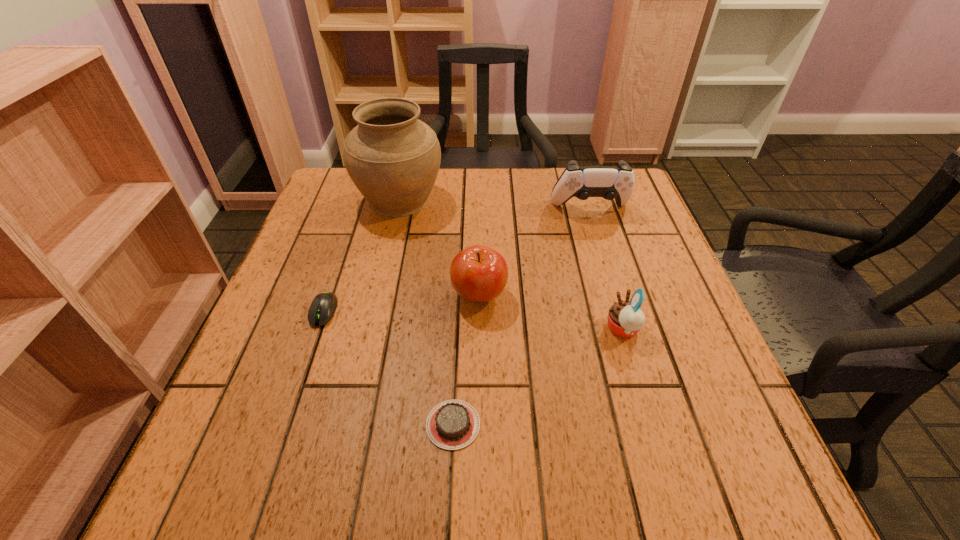
Identify the location of urn. The width and height of the screenshot is (960, 540). (393, 158).

The image size is (960, 540). In order to click on control in this screenshot , I will do click(609, 182).

The height and width of the screenshot is (540, 960). Find the location of `apple`. apple is located at coordinates (478, 273).

Where is `the third shortest object`? The image size is (960, 540). the third shortest object is located at coordinates (625, 318).

At what (x,y) coordinates should I click in order to perform the action: click on computer mouse. Please return your answer as a coordinate pair (x, y). Image resolution: width=960 pixels, height=540 pixels. Looking at the image, I should click on tap(323, 306).

Find the location of a particular element. This screenshot has height=540, width=960. the nearest object is located at coordinates pos(453,424).

This screenshot has width=960, height=540. Find the location of `chocolate cake`. chocolate cake is located at coordinates (453, 424).

Find the location of `vacant space located 0.060m on the front of the urn`. vacant space located 0.060m on the front of the urn is located at coordinates (390, 243).

Find the location of a particular element. vacant space located 0.210m on the front-facing side of the control is located at coordinates (611, 276).

You are a GUI agent. You are given a task and a screenshot of the screen. Output one action in this format:
    pyautogui.click(x=<x>, y=<y>)
    Task: Click on the free point located on the front of the apple
    Image resolution: width=960 pixels, height=540 pixels.
    Given the screenshot: What is the action you would take?
    pyautogui.click(x=479, y=397)